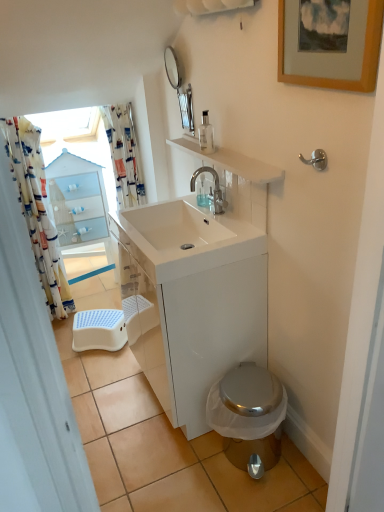
Locate an element on the screen. The width and height of the screenshot is (384, 512). white glossy sink at center is located at coordinates (185, 238).

This screenshot has height=512, width=384. Describe the element at coordinates (37, 211) in the screenshot. I see `printed fabric shower curtain at left, the 1th shower curtain in the left-to-right sequence` at that location.

The width and height of the screenshot is (384, 512). What do you see at coordinates (78, 205) in the screenshot?
I see `white glossy cabinet at upper left` at bounding box center [78, 205].

Locate an element on the screen. white glossy cabinet at upper left is located at coordinates (78, 205).

What is the approximate height of printed fabric shower curtain at upper left, the first shower curtain from the right?

The height of printed fabric shower curtain at upper left, the first shower curtain from the right, is 24.81 inches.

Describe the element at coordinates (191, 300) in the screenshot. I see `white glossy cabinet at center` at that location.

At what (x,y) coordinates should I click in order to perform the action: click on white glossy sink at center. Please return your answer as a coordinate pair (x, y). Image resolution: width=384 pixels, height=512 pixels. Looking at the image, I should click on (185, 238).

Does printed fabric shower curtain at left, the 1th shower curtain in the left-to-right sequence, come behind white glossy cabinet at center?

Yes, printed fabric shower curtain at left, the 1th shower curtain in the left-to-right sequence, is further from the viewer.

How distant is printed fabric shower curtain at left, the 1th shower curtain in the left-to-right sequence, from white glossy cabinet at center?

The distance of printed fabric shower curtain at left, the 1th shower curtain in the left-to-right sequence, from white glossy cabinet at center is 38.80 inches.

From the image's perspective, relative to white glossy cabinet at center, is printed fabric shower curtain at left, the 1th shower curtain in the left-to-right sequence, above or below?

printed fabric shower curtain at left, the 1th shower curtain in the left-to-right sequence, is situated higher than white glossy cabinet at center in the image.

This screenshot has width=384, height=512. I want to click on shower curtain that is the 1st object located above the white glossy cabinet at center (from the image's perspective), so click(x=37, y=211).

From the image's perspective, would you say white glossy cabinet at center is shown under white glossy sink at center?

Indeed, from the image's perspective, white glossy cabinet at center is shown beneath white glossy sink at center.

Is white glossy cabinet at center smaller than white glossy sink at center?

No, white glossy cabinet at center is not smaller than white glossy sink at center.

You are a GUI agent. You are given a task and a screenshot of the screen. Output one action in this format:
    pyautogui.click(x=<x>, y=<y>)
    Task: Click on the sink above the white glossy cabinet at center (from a real-world perspective)
    The image size is (384, 512).
    Given the screenshot: What is the action you would take?
    pyautogui.click(x=185, y=238)

What's the angular difference between white glossy cabinet at center and white glossy sink at center's facing directions?

0.00194 degrees.

How different are the orientations of white glossy cabinet at upper left and white glossy sink at center in degrees?

Result: They differ by 86 degrees in their facing directions.

Is white glossy cabinet at upper left far away from white glossy sink at center?

Yes, white glossy cabinet at upper left and white glossy sink at center are located far from each other.

Which of these two, white glossy cabinet at upper left or white glossy sink at center, is thinner?

Thinner between the two is white glossy cabinet at upper left.

Is point (76, 251) more distant than point (121, 219)?

That is True.

Is printed fabric shower curtain at left, the 2th shower curtain in the right-to-left sequence, turned away from shiny metallic toilet at lower right?

No, printed fabric shower curtain at left, the 2th shower curtain in the right-to-left sequence, is not facing away from shiny metallic toilet at lower right.

From the image's perspective, would you say printed fabric shower curtain at left, the 1th shower curtain in the left-to-right sequence, is shown under shiny metallic toilet at lower right?

No, from the image's perspective, printed fabric shower curtain at left, the 1th shower curtain in the left-to-right sequence, is not below shiny metallic toilet at lower right.

From a real-world perspective, between printed fabric shower curtain at left, the 2th shower curtain in the right-to-left sequence, and shiny metallic toilet at lower right, who is vertically higher?

printed fabric shower curtain at left, the 2th shower curtain in the right-to-left sequence, from a real-world perspective.

From the image's perspective, which is above, satin nickel hook at upper right or white glossy sink at center?

satin nickel hook at upper right is shown above in the image.

Can you confirm if satin nickel hook at upper right is bigger than white glossy sink at center?

No, satin nickel hook at upper right is not bigger than white glossy sink at center.

Looking at this image, which is behind, satin nickel hook at upper right or white glossy sink at center?

Answer: white glossy sink at center is further from the camera.

Where is `towel bar above the white glossy sink at center (from a real-world perspective)`? The image size is (384, 512). towel bar above the white glossy sink at center (from a real-world perspective) is located at coordinates (316, 159).

Who is bigger, white glossy sink at center or clear plastic soap dispenser at upper center, which is the 2th soap dispenser from top to bottom?

Answer: Bigger between the two is white glossy sink at center.

Based on their positions, is white glossy sink at center located to the left or right of clear plastic soap dispenser at upper center, the second soap dispenser in the front-to-back sequence?

Based on their positions, white glossy sink at center is located to the left of clear plastic soap dispenser at upper center, the second soap dispenser in the front-to-back sequence.

At what (x,y) coordinates should I click in order to perform the action: click on sink on the left side of clear plastic soap dispenser at upper center, the second soap dispenser in the front-to-back sequence. Please return your answer as a coordinate pair (x, y). Image resolution: width=384 pixels, height=512 pixels. Looking at the image, I should click on (185, 238).

Is white glossy sink at center positioned with its back to clear plastic soap dispenser at upper center, marked as the 1th soap dispenser in a back-to-front arrangement?

No, white glossy sink at center is not facing the opposite direction of clear plastic soap dispenser at upper center, marked as the 1th soap dispenser in a back-to-front arrangement.

Which point is more distant from viewer, (206, 120) or (71, 304)?

The point (71, 304) is farther.

Locate an element on the screen. The width and height of the screenshot is (384, 512). shower curtain that is the 1st one when counting backward from the clear glass soap dispenser at upper center, which is counted as the 1th soap dispenser, starting from the top is located at coordinates (37, 211).

Are clear glass soap dispenser at upper center, the second soap dispenser ordered from the bottom, and printed fabric shower curtain at left, the 1th shower curtain in the left-to-right sequence, beside each other?

clear glass soap dispenser at upper center, the second soap dispenser ordered from the bottom, and printed fabric shower curtain at left, the 1th shower curtain in the left-to-right sequence, are not in contact.

Find the location of a particular element. bathroom cabinet that appears on the right of printed fabric shower curtain at left, the 1th shower curtain in the left-to-right sequence is located at coordinates (191, 300).

Where is `bathroom cabinet below the white glossy sink at center (from the image's perspective)`? This screenshot has width=384, height=512. bathroom cabinet below the white glossy sink at center (from the image's perspective) is located at coordinates (191, 300).

When comparing their distances from clear glass soap dispenser at upper center, which is counted as the 1th soap dispenser, starting from the top, does satin nickel hook at upper right or white glossy sink at center seem further?

Among the two, satin nickel hook at upper right is located further to clear glass soap dispenser at upper center, which is counted as the 1th soap dispenser, starting from the top.

From the image, which object appears to be farther from wooden picture frame at upper right, white glossy sink at center or printed fabric shower curtain at left, the 1th shower curtain in the left-to-right sequence?

printed fabric shower curtain at left, the 1th shower curtain in the left-to-right sequence, lies further to wooden picture frame at upper right than the other object.

When comparing their distances from wooden picture frame at upper right, does clear plastic soap dispenser at upper center, which is the 2th soap dispenser from top to bottom, or printed fabric shower curtain at upper left, positioned as the 2th shower curtain in left-to-right order, seem closer?

clear plastic soap dispenser at upper center, which is the 2th soap dispenser from top to bottom.

In the scene shown: Considering their positions, is white glossy cabinet at center positioned further to printed fabric shower curtain at left, the 2th shower curtain in the right-to-left sequence, than satin nickel hook at upper right?

Among the two, satin nickel hook at upper right is located further to printed fabric shower curtain at left, the 2th shower curtain in the right-to-left sequence.

Considering their positions, is white glossy sink at center positioned closer to blue plastic step stool at lower left than printed fabric shower curtain at upper left, positioned as the 2th shower curtain in left-to-right order?

printed fabric shower curtain at upper left, positioned as the 2th shower curtain in left-to-right order, is closer to blue plastic step stool at lower left.

Estimate the real-world distances between objects in this image. Which object is further from wooden picture frame at upper right, polished chrome faucet at upper center or clear plastic soap dispenser at upper center, the second soap dispenser in the front-to-back sequence?

clear plastic soap dispenser at upper center, the second soap dispenser in the front-to-back sequence.

Considering their positions, is white glossy cabinet at upper left positioned closer to white glossy sink at center than printed fabric shower curtain at left, the 2th shower curtain in the right-to-left sequence?

printed fabric shower curtain at left, the 2th shower curtain in the right-to-left sequence, is closer to white glossy sink at center.

Considering their positions, is white glossy cabinet at upper left positioned closer to printed fabric shower curtain at upper left, positioned as the 2th shower curtain in left-to-right order, than blue plastic step stool at lower left?

Among the two, white glossy cabinet at upper left is located nearer to printed fabric shower curtain at upper left, positioned as the 2th shower curtain in left-to-right order.

This screenshot has height=512, width=384. Find the location of `tap between wooden picture frame at upper right and blue plastic step stool at lower left in the front-back direction`. tap between wooden picture frame at upper right and blue plastic step stool at lower left in the front-back direction is located at coordinates (213, 191).

Where is `tap between clear plastic soap dispenser at upper center, positioned as the first soap dispenser in bottom-to-top order, and shiny metallic toilet at lower right, in the vertical direction`? The image size is (384, 512). tap between clear plastic soap dispenser at upper center, positioned as the first soap dispenser in bottom-to-top order, and shiny metallic toilet at lower right, in the vertical direction is located at coordinates (213, 191).

Where is `sink positioned between satin nickel hook at upper right and clear glass soap dispenser at upper center, which is counted as the 1th soap dispenser, starting from the top, from near to far`? sink positioned between satin nickel hook at upper right and clear glass soap dispenser at upper center, which is counted as the 1th soap dispenser, starting from the top, from near to far is located at coordinates (185, 238).

The image size is (384, 512). Identify the location of towel bar between wooden picture frame at upper right and clear plastic soap dispenser at upper center, which is the 2th soap dispenser from top to bottom, along the z-axis. (316, 159).